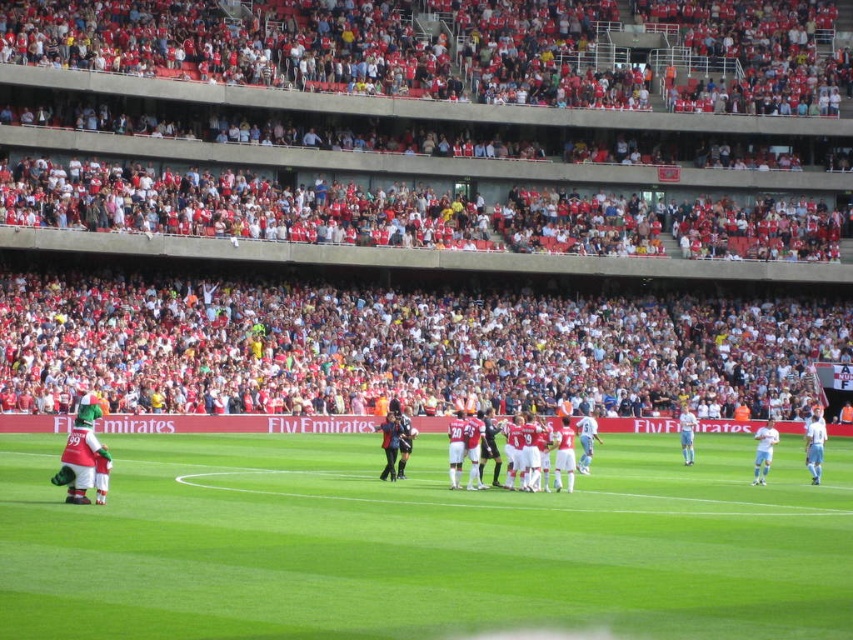
Measure the distance from red fabric crowd at upper center to green grass field at center.

They are 20.46 meters apart.

The width and height of the screenshot is (853, 640). What do you see at coordinates (407, 182) in the screenshot?
I see `red fabric crowd at upper center` at bounding box center [407, 182].

Image resolution: width=853 pixels, height=640 pixels. I want to click on red fabric crowd at upper center, so click(x=407, y=182).